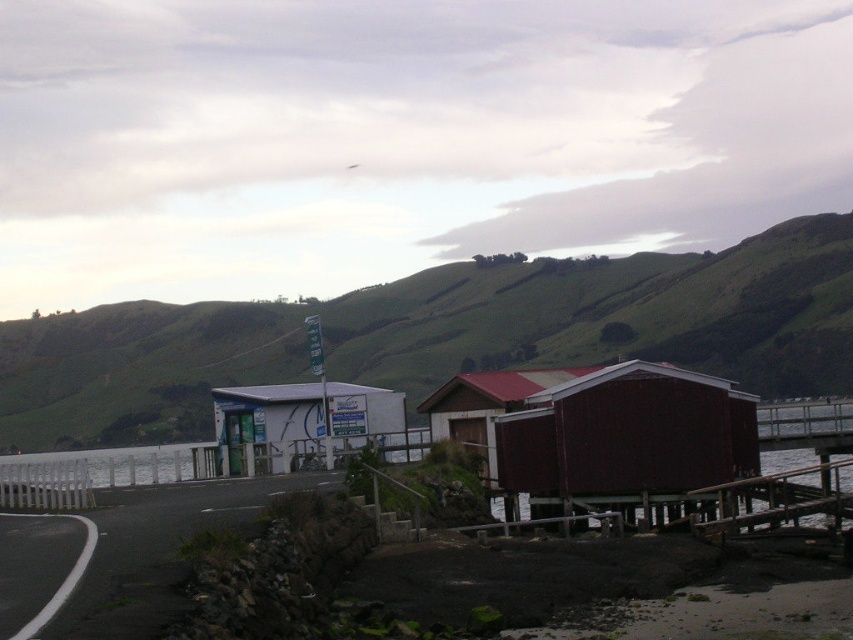
You are a delivery person trying to park your van between the white plastic building at center and the wooden cabin at center. The van is 2.5 meters wide. Can you fit the van between them?

The white plastic building at center might be wider than wooden cabin at center, so it is uncertain whether the space between them can accommodate a 2.5 meter wide van. Check the actual width before attempting to park.

You are a hiker who has just arrived at this coastal area. You need to decide whether to place your tent near the white plastic building at center or the wooden cabin at center. Based on their positions, which one is located lower in elevation?

The white plastic building at center is below the wooden cabin at center, so it is located at a lower elevation. Therefore, placing your tent near the white plastic building at center would be at a lower elevation than the wooden cabin at center.